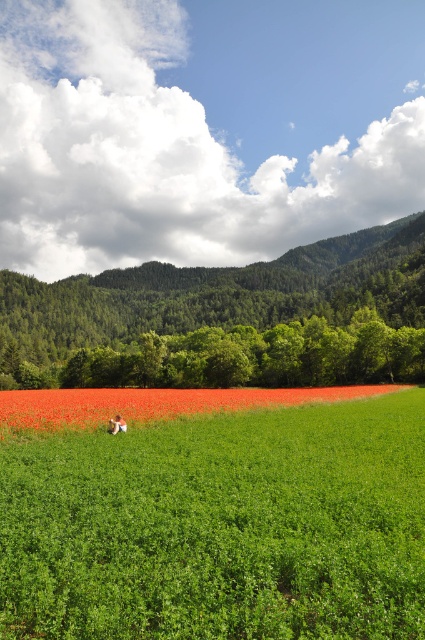
You are standing in the rural landscape and want to take a photo of the green forested mountain at center and the light brown hair at center. Which object should you focus on first to ensure both are in clear view?

You should focus on the light brown hair at center first because it is closer to you than the green forested mountain at center, which is further away. This ensures both are in focus as the mountain is behind the hair.